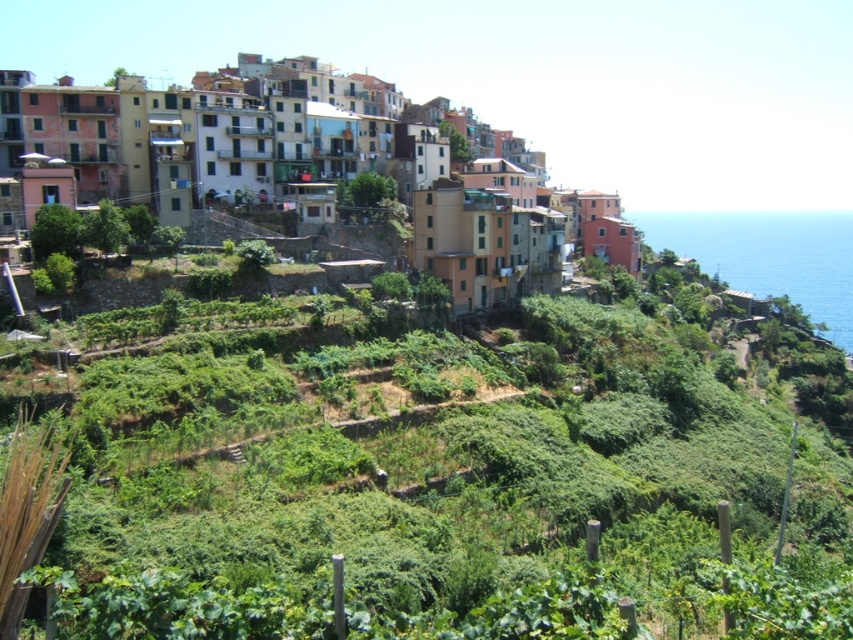
Question: Does green leafy plants at center appear over multicolored stone buildings at upper center?

Choices:
 (A) no
 (B) yes

Answer: (A)

Question: Which of the following is the closest to the observer?

Choices:
 (A) (242, 102)
 (B) (747, 240)
 (C) (479, 509)

Answer: (C)

Question: Does multicolored stone buildings at upper center have a lesser width compared to blue liquid water at right?

Choices:
 (A) no
 (B) yes

Answer: (B)

Question: Which object is farther from the camera taking this photo?

Choices:
 (A) multicolored stone buildings at upper center
 (B) green leafy plants at center

Answer: (A)

Question: Does green leafy plants at center lie behind blue liquid water at right?

Choices:
 (A) yes
 (B) no

Answer: (B)

Question: Which object appears farthest from the camera in this image?

Choices:
 (A) multicolored stone buildings at upper center
 (B) green leafy plants at center
 (C) blue liquid water at right

Answer: (C)